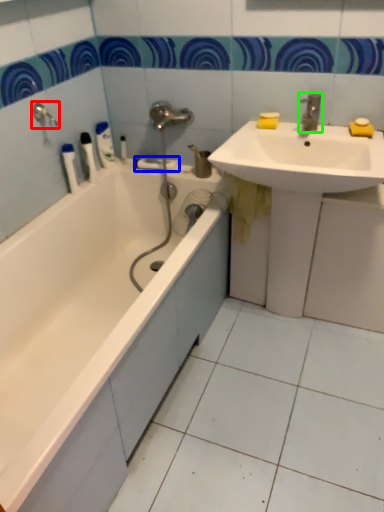
Question: Which object is positioned closest to shower (highlighted by a red box)? Select from towel bar (highlighted by a blue box) and tap (highlighted by a green box).

Choices:
 (A) towel bar
 (B) tap

Answer: (A)